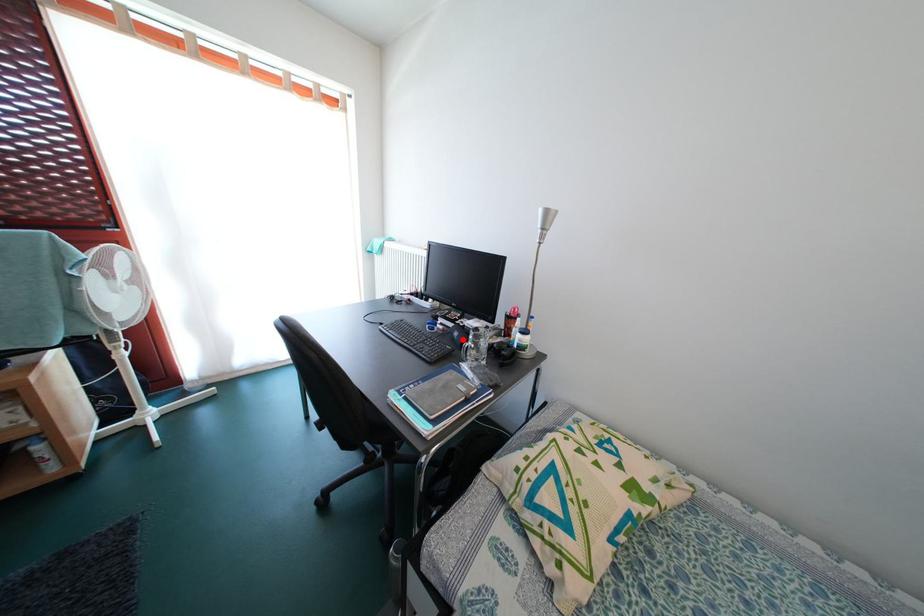
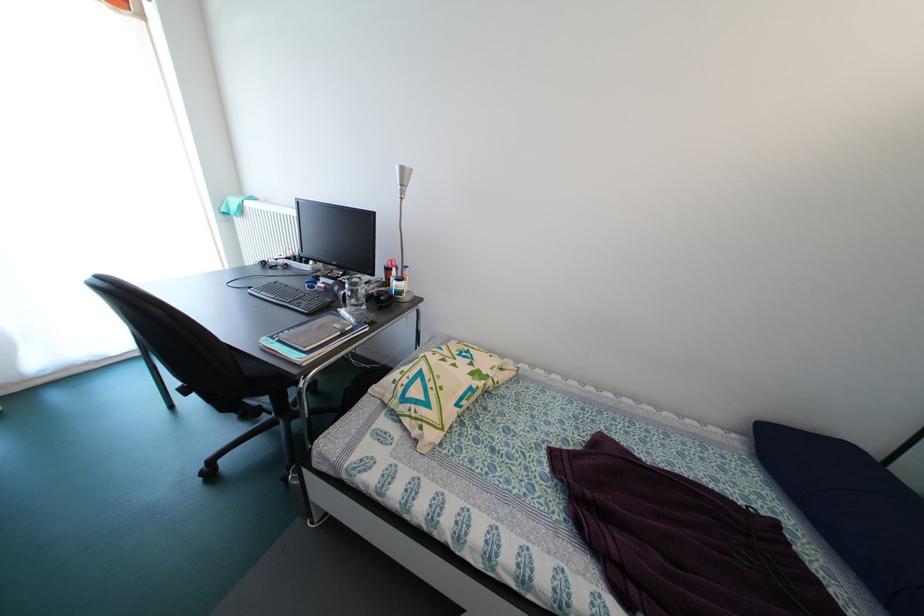
Question: I am providing you with two images of the same scene from different viewpoints. Image1 has a red point marked. In image2, the corresponding 3D location appears at what relative position? Reply with the corresponding letter.

Choices:
 (A) Closer
 (B) Farther

Answer: (A)